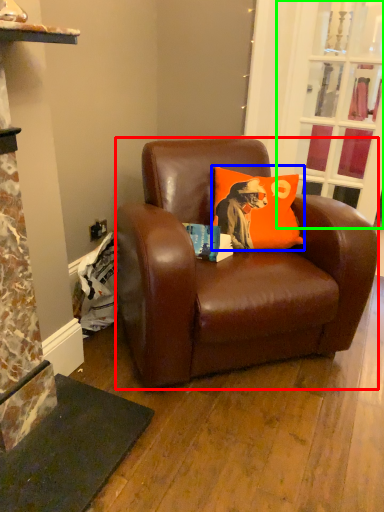
Question: Which is farther away from studio couch (highlighted by a red box)? pillow (highlighted by a blue box) or glass door (highlighted by a green box)?

Choices:
 (A) pillow
 (B) glass door

Answer: (B)